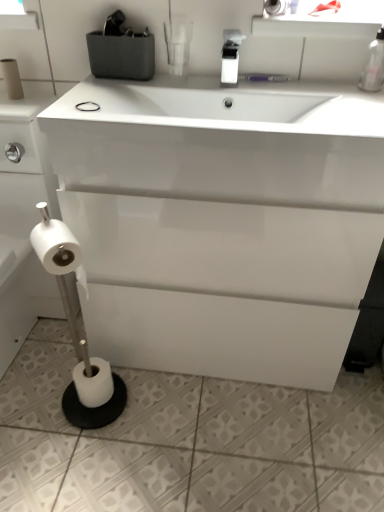
Question: Is white matte toilet paper at upper center, the first toilet paper when ordered from right to left, to the left or to the right of black rubber band at upper center in the image?

Choices:
 (A) left
 (B) right

Answer: (B)

Question: From a real-world perspective, is white matte toilet paper at upper center, the first toilet paper when ordered from right to left, positioned above or below black rubber band at upper center?

Choices:
 (A) above
 (B) below

Answer: (A)

Question: Estimate the real-world distances between objects in this image. Which object is closer to the white matte toilet paper at upper center, the 4th toilet paper positioned from the left?

Choices:
 (A) white matte toilet paper at lower left, positioned as the first toilet paper in bottom-to-top order
 (B) white matte toilet paper at left, which is counted as the 1th toilet paper, starting from the left
 (C) transparent glass spray bottle at upper right, positioned as the second bottle in left-to-right order
 (D) black rubber band at upper center
 (E) white glossy cabinet at center

Answer: (C)

Question: Estimate the real-world distances between objects in this image. Which object is closer to the transparent glass spray bottle at upper right, the 1th bottle in the right-to-left sequence?

Choices:
 (A) white glossy cabinet at center
 (B) white glossy soap dispenser at upper center, the 2th bottle in the right-to-left sequence
 (C) white matte toilet paper at lower left, arranged as the third toilet paper when viewed from the top
 (D) black rubber band at upper center
 (E) transparent plastic window screen at upper left

Answer: (B)